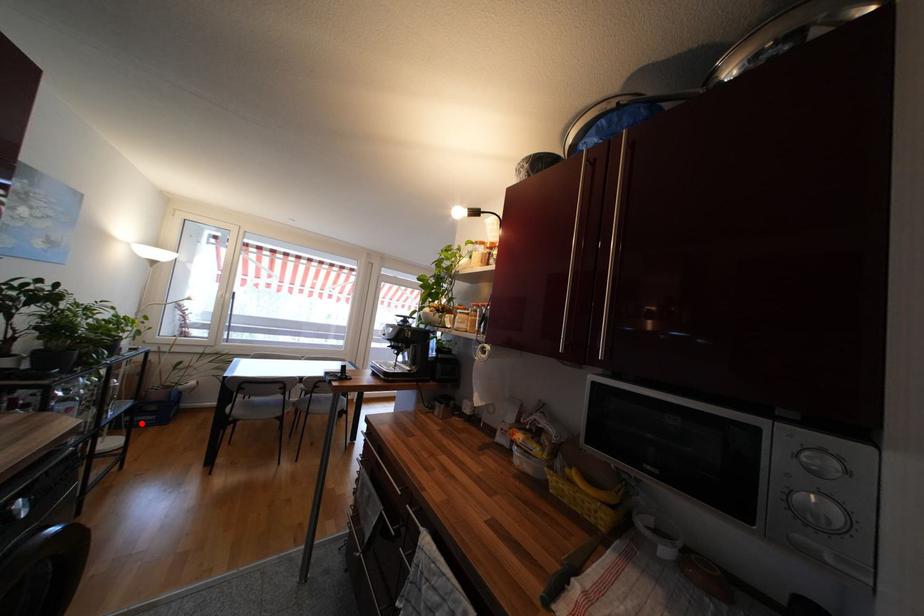
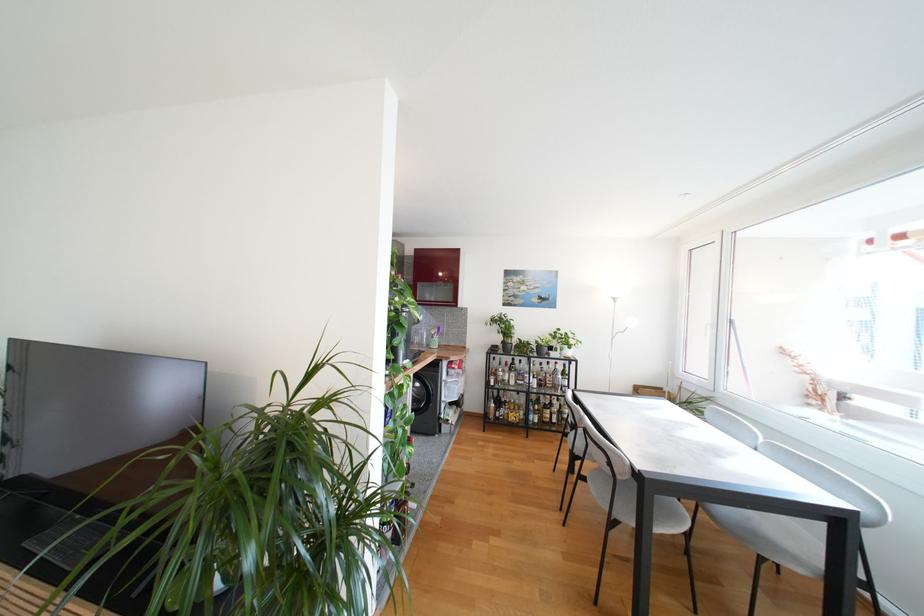
Question: I am providing you with two images of the same scene from different viewpoints. A red point is marked on the first image. Can you still see the location of the red point in image 2?

Choices:
 (A) Yes
 (B) No

Answer: (B)